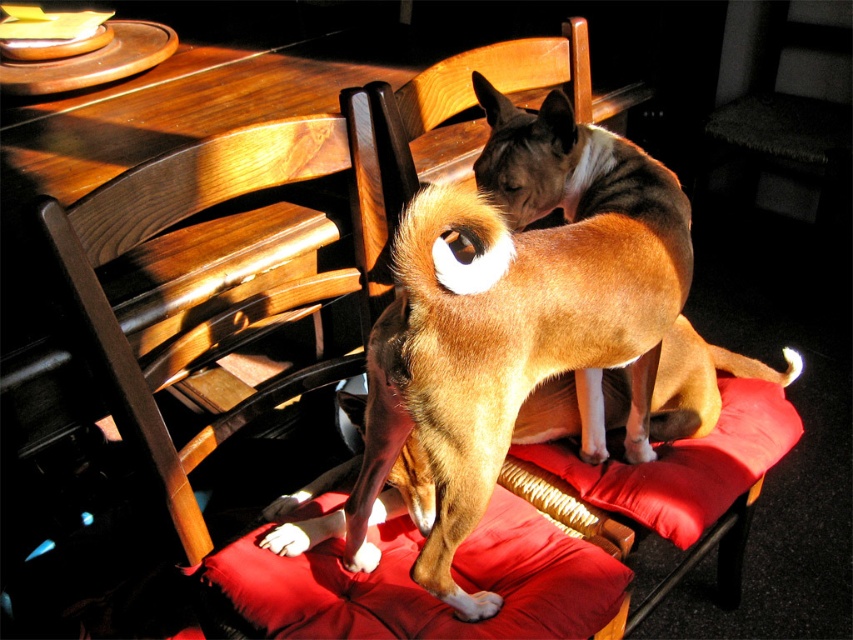
Does brown fur dog at center have a lesser width compared to velvet red cushion at center?

Incorrect, brown fur dog at center's width is not less than velvet red cushion at center's.

Does brown fur dog at center appear over velvet red cushion at center?

Correct, brown fur dog at center is located above velvet red cushion at center.

Identify the location of brown fur dog at center. The image size is (853, 640). (520, 337).